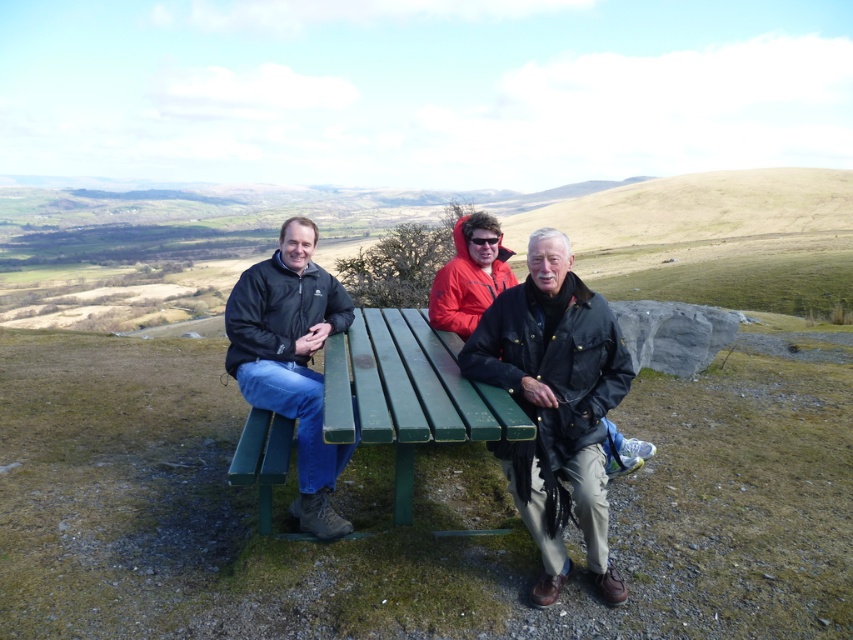
Question: Where is black leather jacket at center located in relation to matte black jacket at left in the image?

Choices:
 (A) right
 (B) left

Answer: (A)

Question: Among these points, which one is nearest to the camera?

Choices:
 (A) (363, 340)
 (B) (463, 380)

Answer: (B)

Question: Which point appears farthest from the camera in this image?

Choices:
 (A) (544, 566)
 (B) (535, 266)
 (C) (308, 444)
 (D) (498, 436)

Answer: (C)

Question: Which object is closer to the camera taking this photo?

Choices:
 (A) green painted wood bench at center
 (B) matte black jacket at left

Answer: (A)

Question: Does black leather jacket at center appear on the left side of matte black jacket at left?

Choices:
 (A) no
 (B) yes

Answer: (A)

Question: Can you confirm if green painted wood table at center is positioned below orange softshell jacket at center?

Choices:
 (A) no
 (B) yes

Answer: (B)